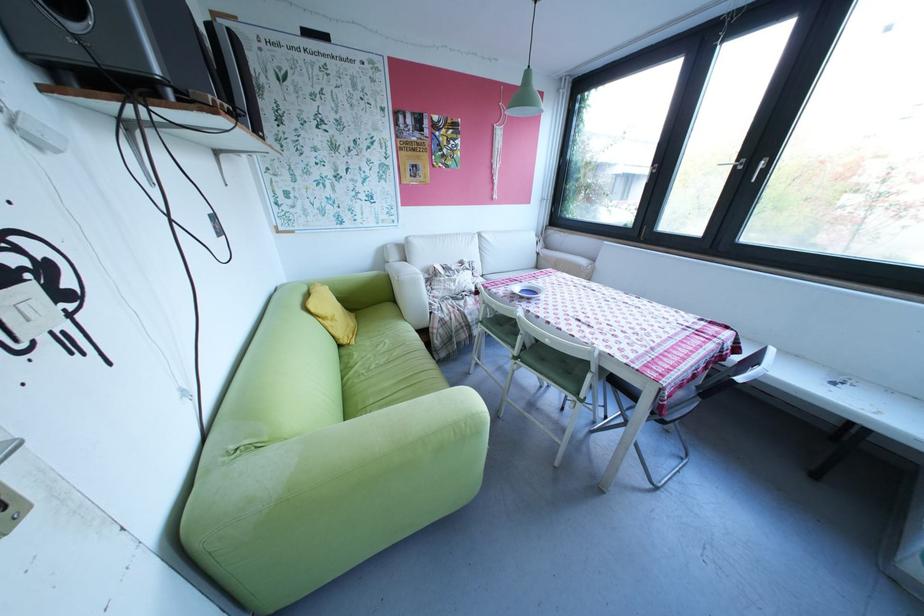
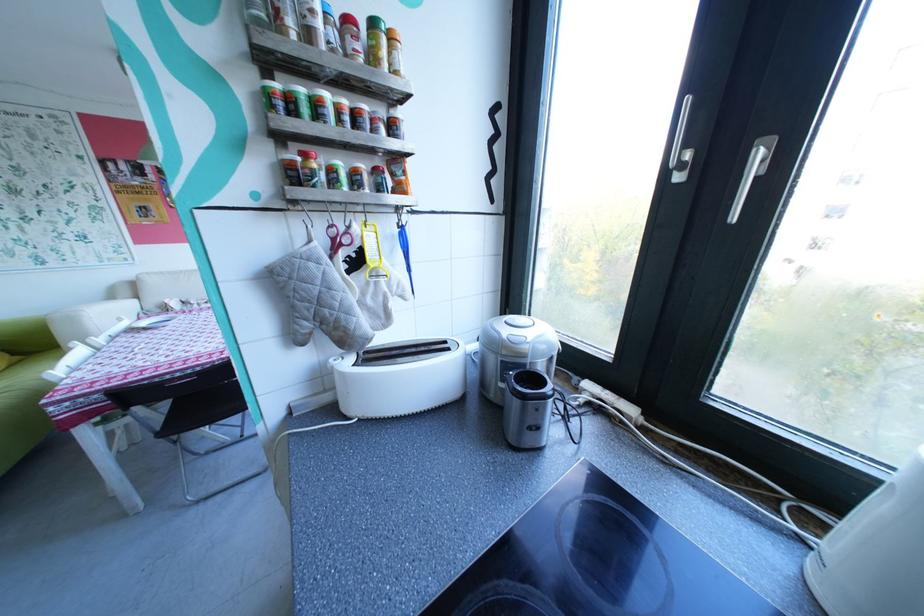
Question: What movement of the cameraman would produce the second image?

Choices:
 (A) Left
 (B) Right
 (C) Forward
 (D) Backward

Answer: (B)